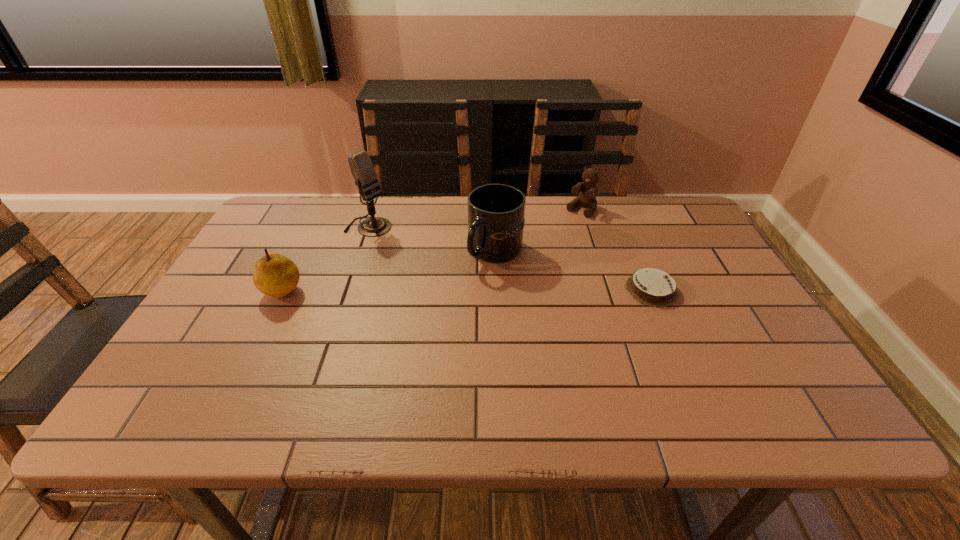
This screenshot has height=540, width=960. In order to click on pear in this screenshot , I will do click(x=276, y=275).

What are the coordinates of `chocolate cake` in the screenshot? It's located at (652, 287).

I want to click on mug, so click(496, 212).

The height and width of the screenshot is (540, 960). I want to click on the second tallest object, so click(496, 212).

Where is `teddy bear`? teddy bear is located at coordinates (587, 197).

Identify the location of the tallest object. (361, 166).

What are the coordinates of `the fourth object from right to left` in the screenshot? It's located at (361, 166).

Where is `vacant region located on the back of the pear`? The image size is (960, 540). vacant region located on the back of the pear is located at coordinates (321, 212).

Locate an element on the screen. This screenshot has width=960, height=540. vacant space located 0.330m on the left of the shortest object is located at coordinates (495, 289).

Where is `free region located with the handle on the side of the second tallest object`? free region located with the handle on the side of the second tallest object is located at coordinates (393, 309).